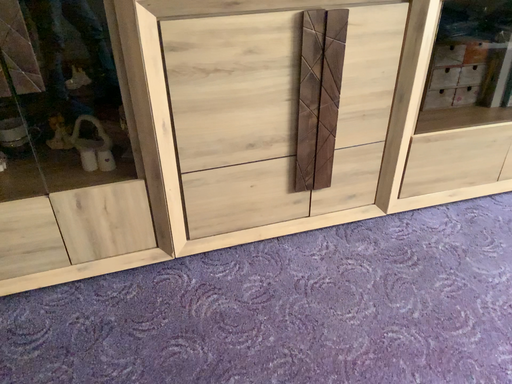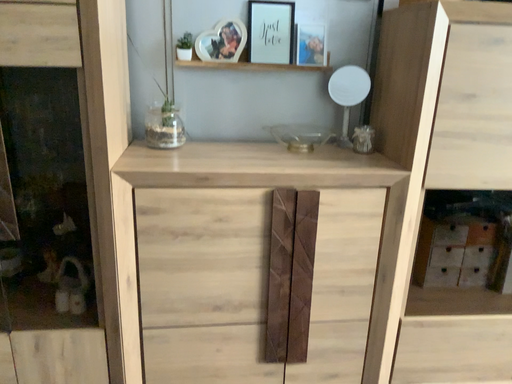
Question: Which way did the camera rotate in the video?

Choices:
 (A) rotated downward
 (B) rotated upward

Answer: (B)